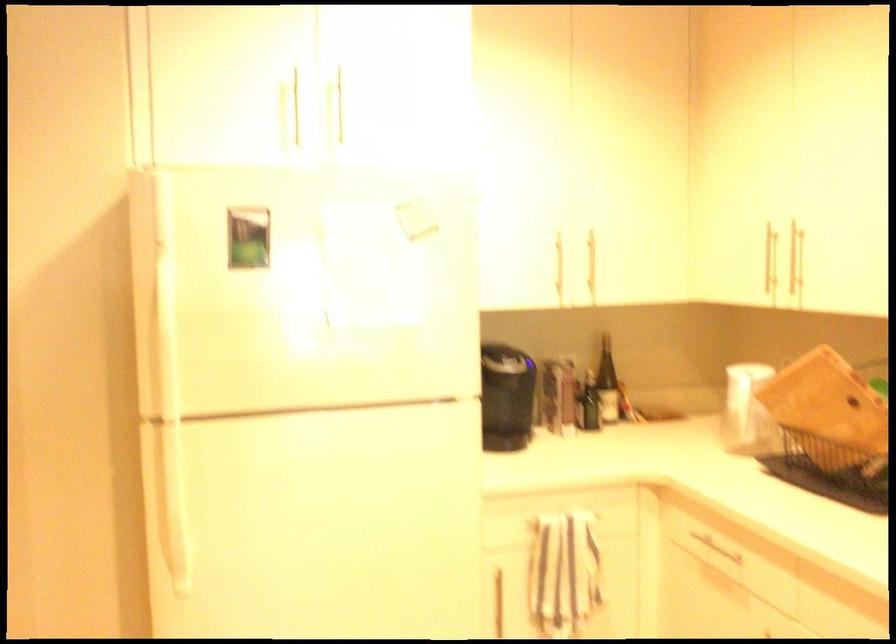
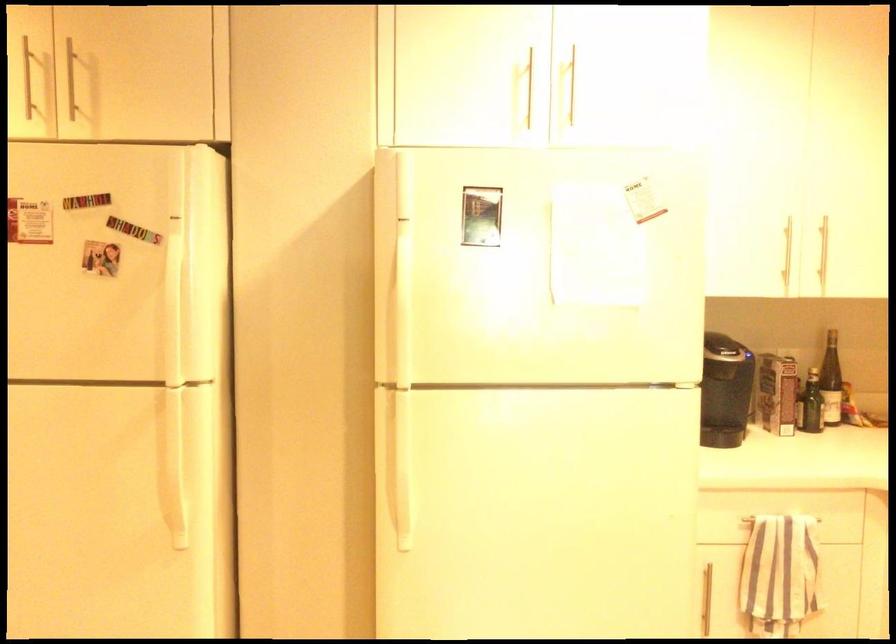
Where in the second image is the point corresponding to point 609,380 from the first image?

(831, 381)